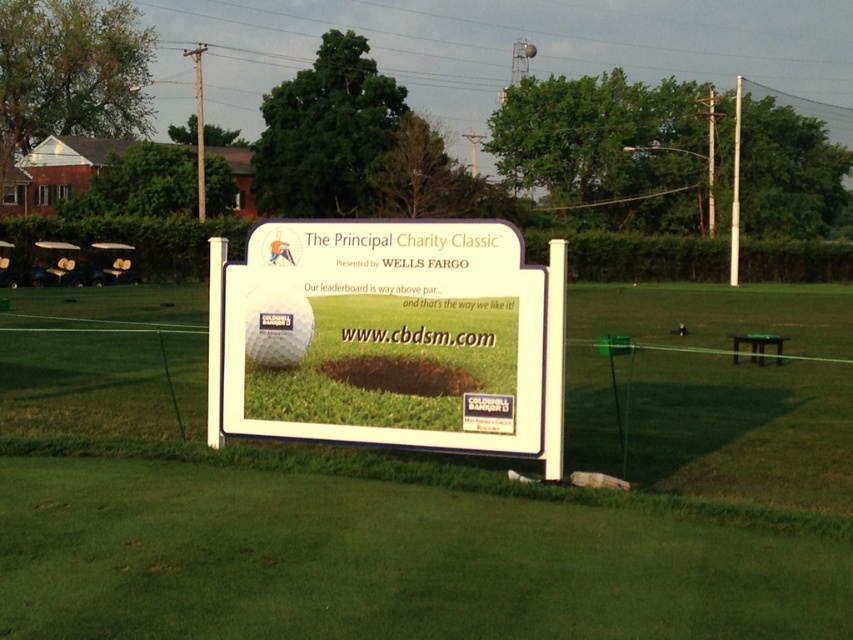
Between white matte sign at center and white plastic sign at center, which one has more height?

With more height is white plastic sign at center.

Is white matte sign at center wider than white plastic sign at center?

Yes.

Is point (473, 632) in front of point (556, 262)?

Yes, point (473, 632) is in front of point (556, 262).

I want to click on white matte sign at center, so click(403, 506).